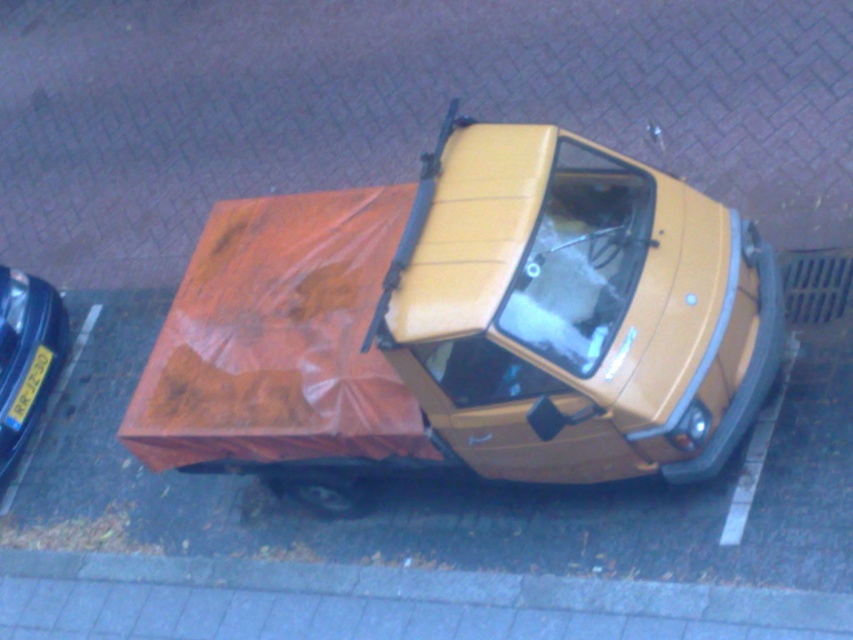
You are a delivery person who needs to lift the yellow plastic license plate at lower left to check its serial number. Given that the matte yellow car at center is blocking access to it, can you estimate if the license plate is within reach without moving the car?

The matte yellow car at center is taller than the yellow plastic license plate at lower left. Since the car is blocking access, you would need to move it to reach the license plate.

You are a delivery person who needs to load both the shiny blue car at left and the yellow plastic license plate at lower left into a truck. The truck has a loading bay that is 2 meters wide. Can both items fit side by side without overlapping?

The shiny blue car at left might be wider than yellow plastic license plate at lower left, so it is uncertain if both can fit side by side in the 2 meter wide loading bay without overlapping. Measure their combined width first.